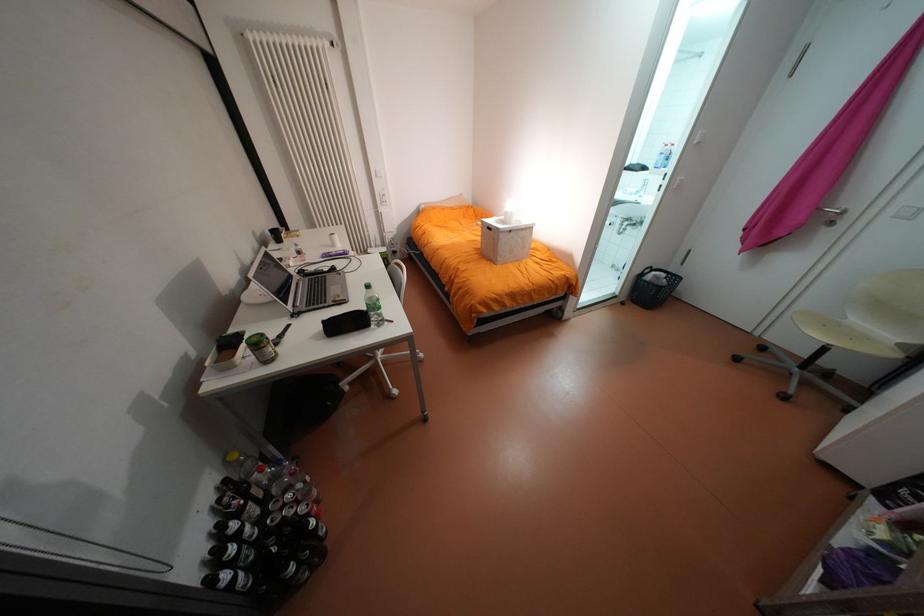
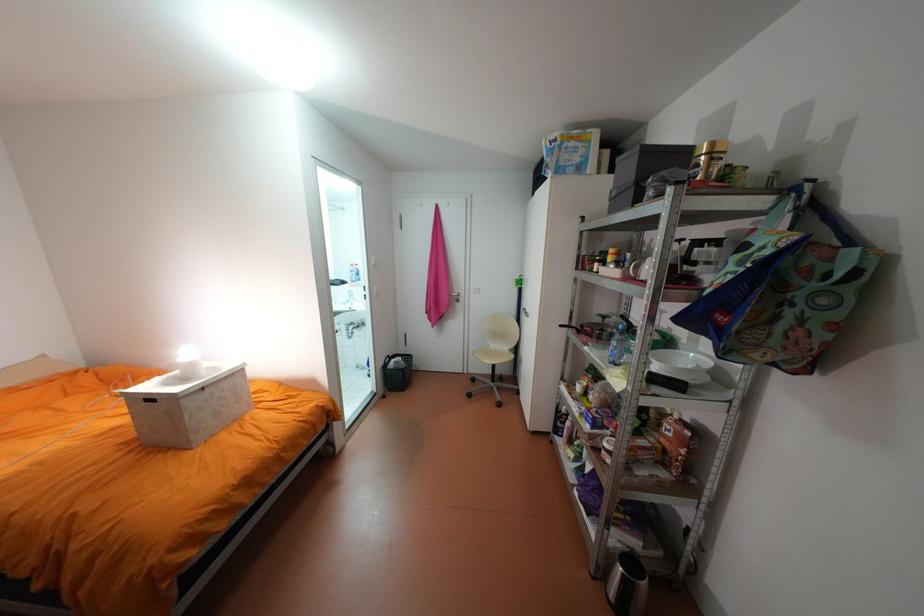
Locate, in the second image, the point that corresponds to point 513,222 in the first image.

(189, 379)